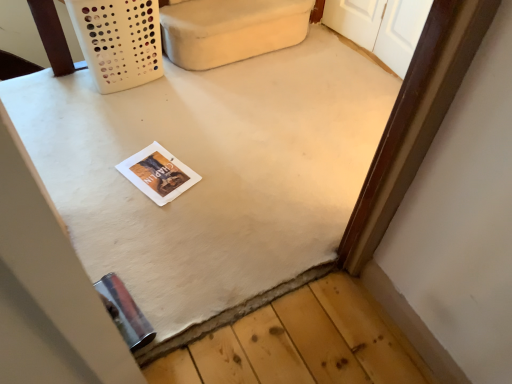
The height and width of the screenshot is (384, 512). Identify the location of vacant area that is in front of white paper magazine at center. (145, 216).